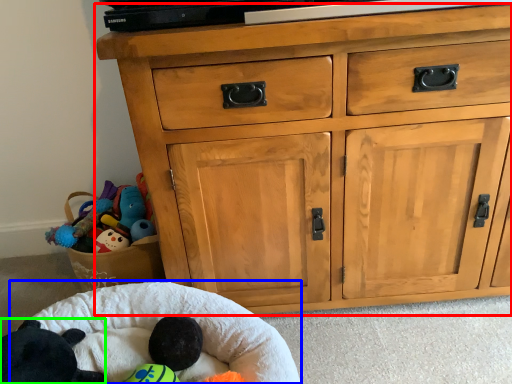
Question: Which object is the farthest from chest of drawers (highlighted by a red box)? Choose among these: infant bed (highlighted by a blue box) or animal (highlighted by a green box).

Choices:
 (A) infant bed
 (B) animal

Answer: (B)